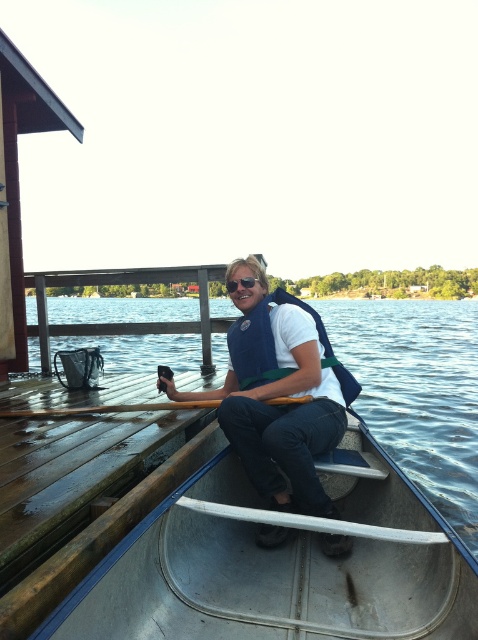
You are on a boat and need to store a small item. The boat has two areas available for storage. Which area can hold a larger item, the clear water at boat center or the wooden at left?

The clear water at boat center is bigger than the wooden at left, so the clear water at boat center can hold a larger item.

You are a drone operator trying to capture a photo of the white matte life vest at center. The drone is currently at the point marked by coordinates point (x=278, y=394). Is the drone positioned directly above the white matte life vest at center?

The point (x=278, y=394) represents the white matte life vest at center, so yes, the drone is positioned directly above the white matte life vest at center.

You are a safety inspector checking the boat setup. According to the image, is the sunglasses at center positioned in a way that might fall into the clear water at boat center? Explain why or why not based on their positions.

The clear water at boat center is located above the sunglasses at center, meaning the sunglasses are positioned below the water level. Since the sunglasses are below the water, they are already submerged and cannot fall further into the water. However, this suggests they might not be securely placed and could be lost.